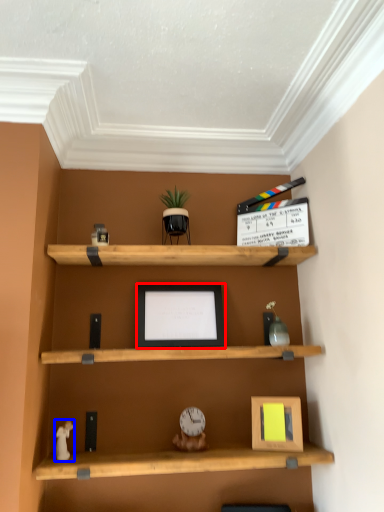
Question: Which of the following is the farthest to the observer, picture frame (highlighted by a red box) or toy (highlighted by a blue box)?

Choices:
 (A) picture frame
 (B) toy

Answer: (A)